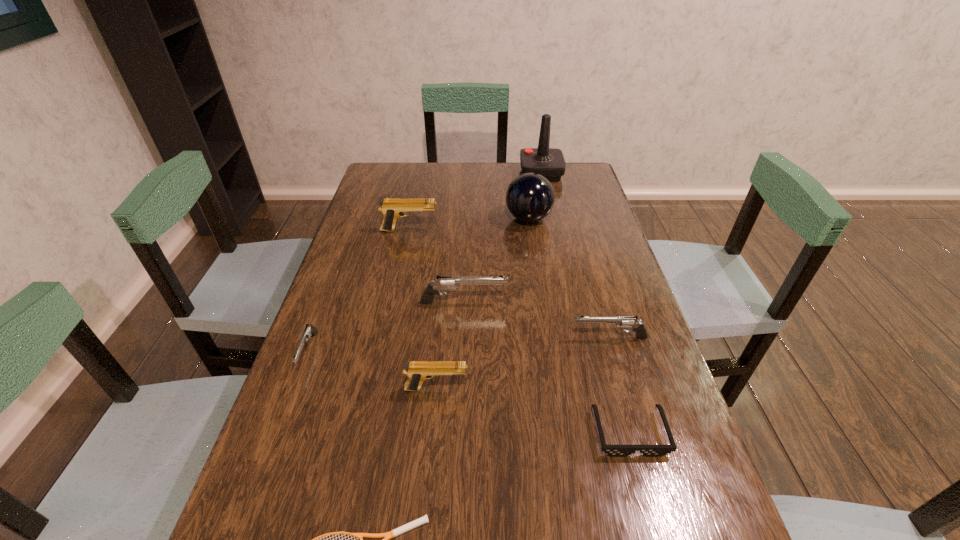
Image resolution: width=960 pixels, height=540 pixels. Find the location of `the tallest object`. the tallest object is located at coordinates (549, 162).

Find the location of a particular element. Image resolution: width=960 pixels, height=540 pixels. joystick is located at coordinates (549, 162).

You are a GUI agent. You are given a task and a screenshot of the screen. Output one action in this format:
    pyautogui.click(x=<x>, y=<y>)
    Task: Click on the eighth shortest object
    This screenshot has width=960, height=540.
    Given the screenshot: What is the action you would take?
    [x=530, y=197]

Identify the location of black bowling ball. (530, 197).

Where is `the farther tan pistol`? This screenshot has height=540, width=960. the farther tan pistol is located at coordinates (392, 208).

I want to click on the bigger tan pistol, so click(392, 208).

Locate an element on the screen. The width and height of the screenshot is (960, 540). the biggest silver pistol is located at coordinates (443, 283).

Find the location of a particular element. the second silver pistol from left to right is located at coordinates (443, 283).

At what (x,y) coordinates should I click in order to perform the action: click on the smaller tan pistol. Please return your answer as a coordinate pair (x, y). The image size is (960, 540). Looking at the image, I should click on click(x=417, y=371).

Where is `the third nearest object`? the third nearest object is located at coordinates (417, 371).